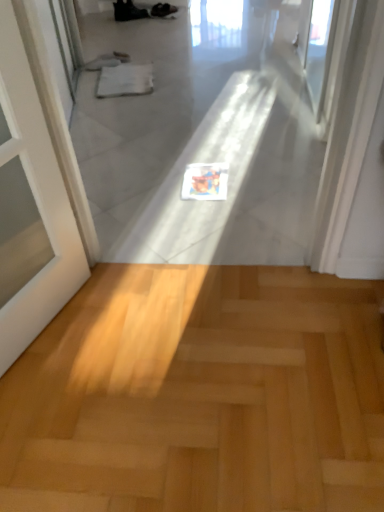
The width and height of the screenshot is (384, 512). What do you see at coordinates (200, 394) in the screenshot?
I see `light wood stairs at center` at bounding box center [200, 394].

The width and height of the screenshot is (384, 512). In order to click on light wood stairs at center in this screenshot , I will do `click(200, 394)`.

I want to click on light wood stairs at center, so click(x=200, y=394).